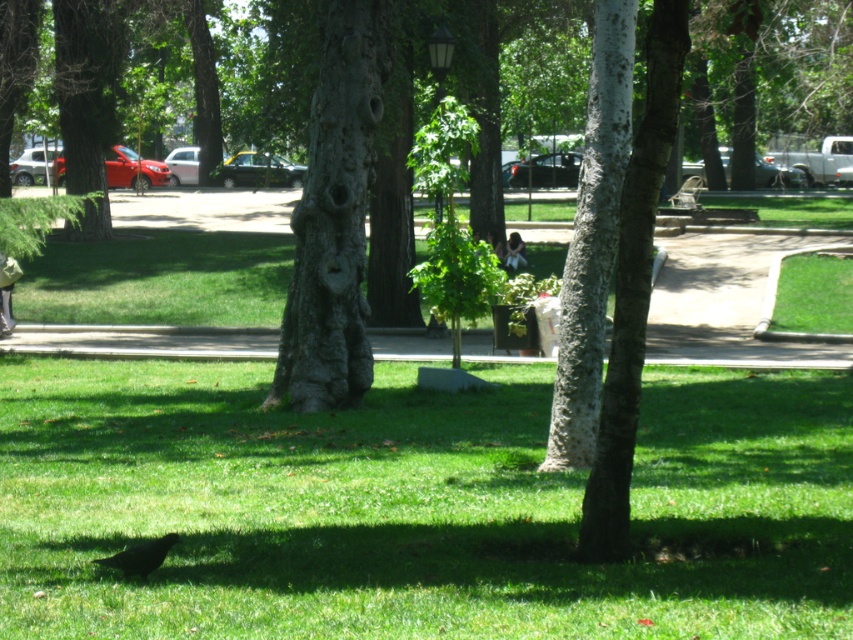
You are a park visitor who wants to place a small bench between the white textured tree trunk at center and the shiny black bird at lower left. Based on their positions, will the bench fit horizontally between them?

The white textured tree trunk at center is positioned over the shiny black bird at lower left, which means they are vertically aligned rather than horizontally spaced apart. Placing a bench between them horizontally may not be feasible since they are stacked vertically.

You are standing at the point labeled as point (334, 218) in the park. What type of tree are you directly facing?

The point (334, 218) corresponds to a rough bark tree at center, so you are directly facing a rough bark tree at center.